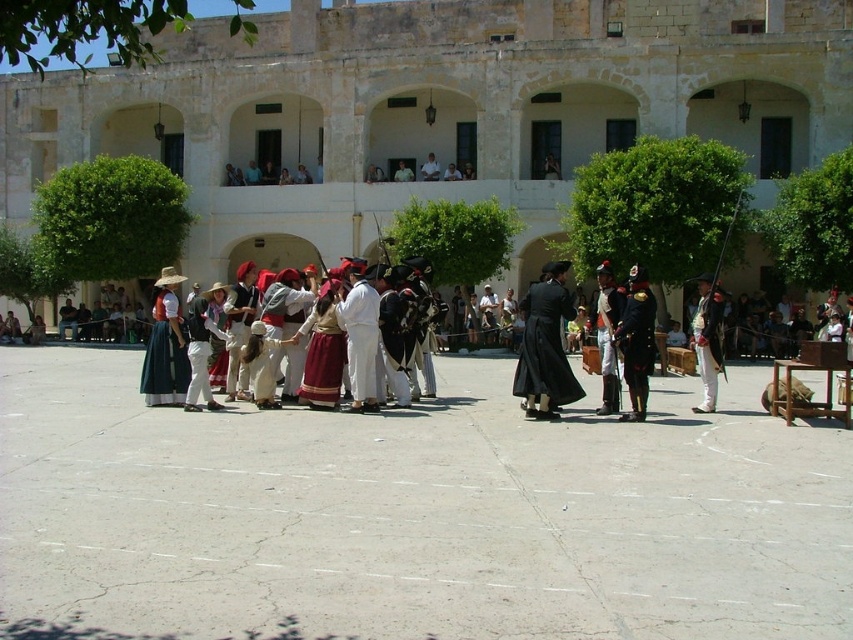
What are the coordinates of `white cotton shirt at center` in the screenshot? It's located at (706, 340).

Image resolution: width=853 pixels, height=640 pixels. I want to click on white cotton shirt at center, so click(706, 340).

This screenshot has width=853, height=640. What are the coordinates of `white cotton shirt at center` in the screenshot? It's located at (706, 340).

Who is taller, beige stone building at center or white cotton shirt at center?

With more height is beige stone building at center.

Does beige stone building at center have a lesser width compared to white cotton shirt at center?

In fact, beige stone building at center might be wider than white cotton shirt at center.

The width and height of the screenshot is (853, 640). Identify the location of beige stone building at center. (x=434, y=108).

You are a GUI agent. You are given a task and a screenshot of the screen. Output one action in this format:
    pyautogui.click(x=<x>, y=<y>)
    Task: Click on the beige stone building at center
    This screenshot has width=853, height=640.
    Given the screenshot: What is the action you would take?
    pyautogui.click(x=434, y=108)

Is light brown leather jacket at center bigger than light green fabric shirt at center?

Yes.

Locate an element on the screen. The image size is (853, 640). light brown leather jacket at center is located at coordinates (430, 168).

Between point (438, 170) and point (404, 168), which one is positioned in front?

Positioned in front is point (438, 170).

You are a GUI agent. You are given a task and a screenshot of the screen. Output one action in this format:
    pyautogui.click(x=<x>, y=<y>)
    Task: Click on the light brown leather jacket at center
    
    Given the screenshot: What is the action you would take?
    pyautogui.click(x=430, y=168)